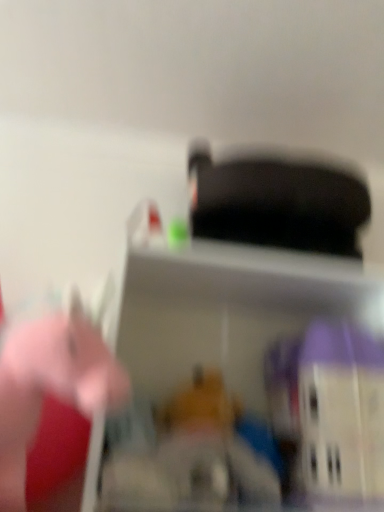
Find the location of `pink rubber piggy bank at lower left`. pink rubber piggy bank at lower left is located at coordinates (49, 389).

What do you see at coordinates (49, 389) in the screenshot?
I see `pink rubber piggy bank at lower left` at bounding box center [49, 389].

The image size is (384, 512). I want to click on pink rubber piggy bank at lower left, so click(49, 389).